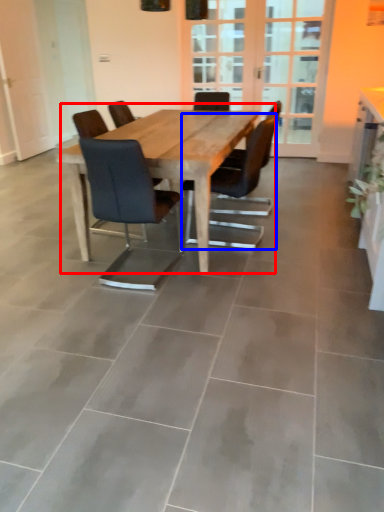
Question: Which of the following is the closest to the observer, kitchen & dining room table (highlighted by a red box) or chair (highlighted by a blue box)?

Choices:
 (A) kitchen & dining room table
 (B) chair

Answer: (A)